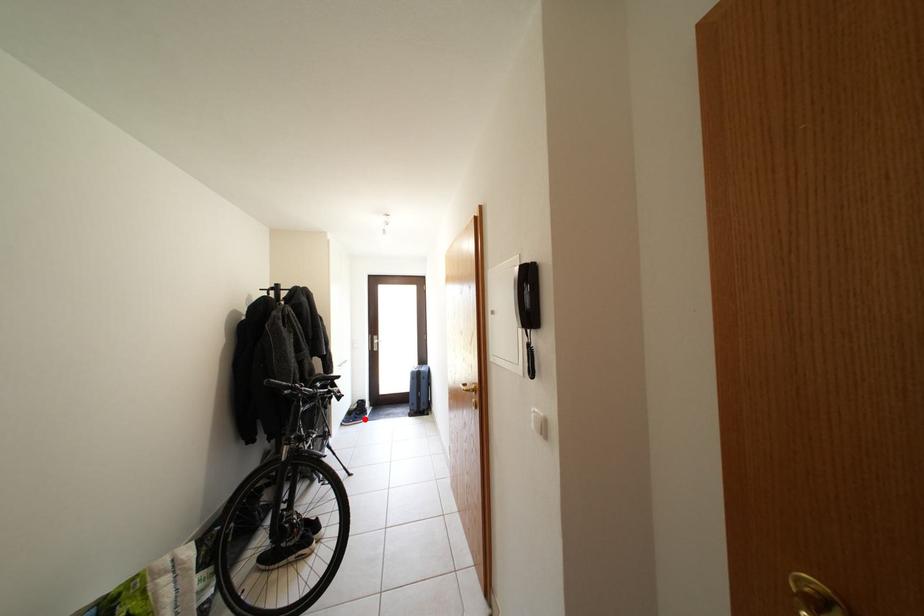
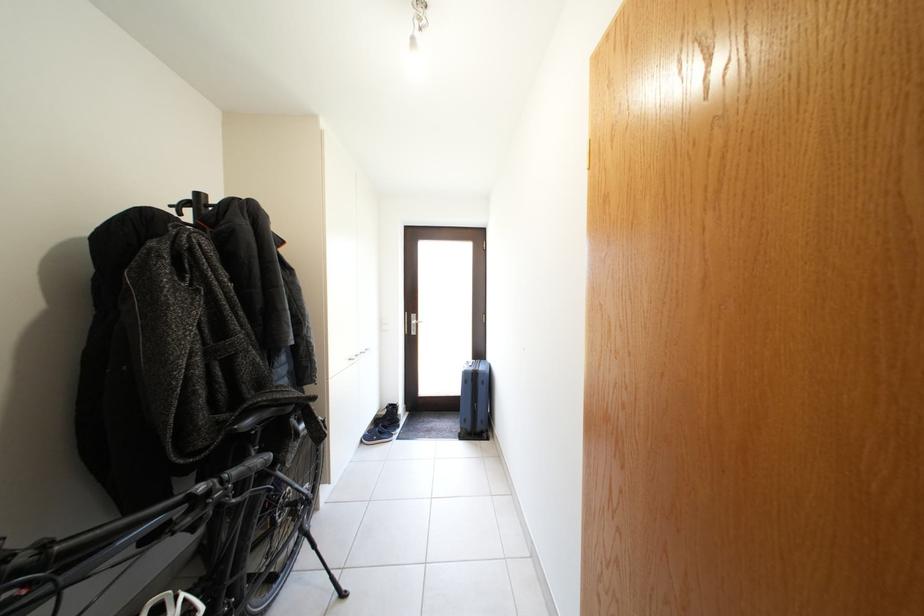
Question: I am providing you with two images of the same scene from different viewpoints. Image1 has a red point marked. In image2, the corresponding 3D location appears at what relative position? Reply with the corresponding letter.

Choices:
 (A) Closer
 (B) Farther

Answer: (A)